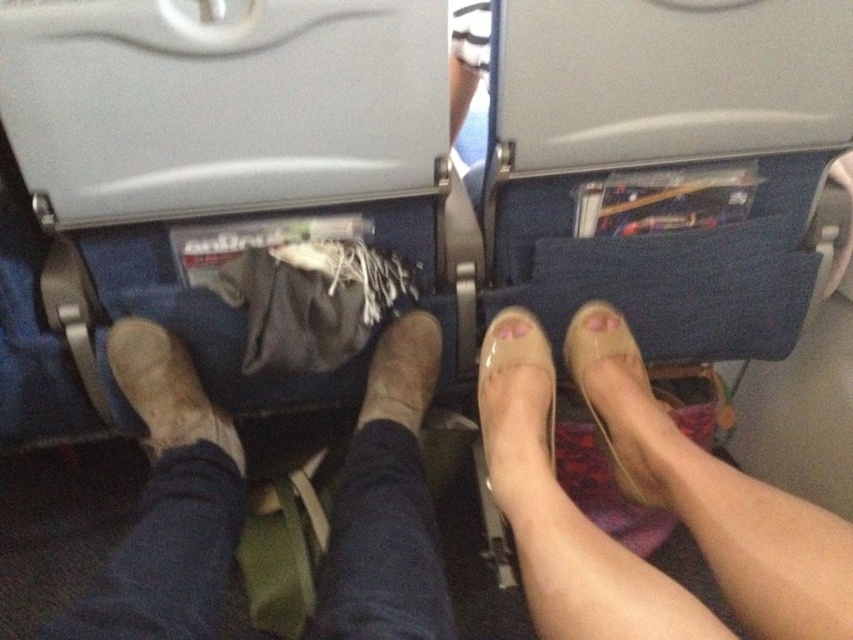
Question: Which object is closer to the camera taking this photo?

Choices:
 (A) pink matte toe at center
 (B) pink glossy toe at center

Answer: (B)

Question: Does clear plastic shoes at center appear on the right side of clear plastic shoe at center?

Choices:
 (A) no
 (B) yes

Answer: (B)

Question: Does leather boot at left lie in front of clear plastic shoe at center?

Choices:
 (A) yes
 (B) no

Answer: (B)

Question: Which object is the farthest from the satin beige shoe at center?

Choices:
 (A) pink glossy toe at center
 (B) pink matte toe at center
 (C) clear plastic shoe at center
 (D) leather boot at center

Answer: (D)

Question: Does satin beige shoe at center appear on the right side of pink glossy toe at center?

Choices:
 (A) no
 (B) yes

Answer: (B)

Question: Among these objects, which one is nearest to the camera?

Choices:
 (A) clear plastic shoe at center
 (B) satin beige shoe at center

Answer: (B)